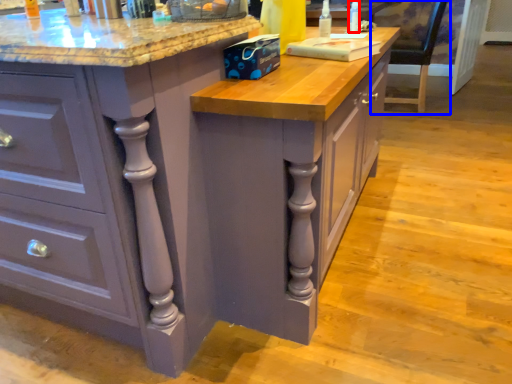
Question: Which object appears closest to the camera in this image, bottle (highlighted by a red box) or chair (highlighted by a blue box)?

Choices:
 (A) bottle
 (B) chair

Answer: (A)